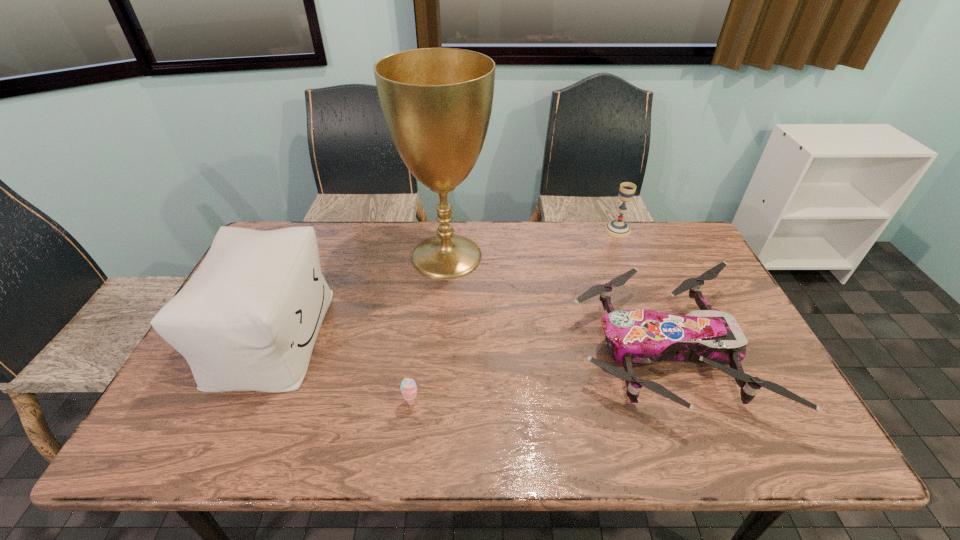
Identify the location of the biggest white detergent. (571, 132).

Locate an element on the screen. the tallest detergent is located at coordinates (571, 132).

Find the location of a particular element. The width and height of the screenshot is (960, 540). the third smallest white detergent is located at coordinates (245, 199).

Find the location of a particular element. the leftmost white detergent is located at coordinates (245, 199).

Identify the location of the rightmost detergent. Image resolution: width=960 pixels, height=540 pixels. (685, 172).

Locate an element on the screen. This screenshot has height=540, width=960. the third biggest white detergent is located at coordinates pyautogui.click(x=685, y=172).

The width and height of the screenshot is (960, 540). Identify the location of the fifth detergent from right to left. (387, 183).

Where is `the third object from left to right`? The image size is (960, 540). the third object from left to right is located at coordinates (387, 183).

I want to click on the smallest white detergent, so click(626, 338).

This screenshot has width=960, height=540. What are the coordinates of `the nearer blue detergent` in the screenshot? It's located at (505, 293).